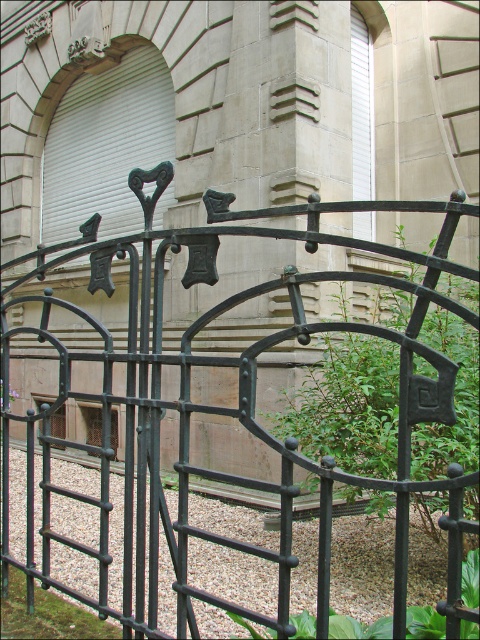
You are standing in front of a building and want to take a photo of the black wrought iron gate at center. If your camera can focus on objects as close as 1.5 meters, will you need to step back to take a clear photo of the gate?

The black wrought iron gate at center is 1.80 meters away from the viewer. Since the camera can focus as close as 1.5 meters, the distance is within the camera range. Therefore, you do not need to step back to take a clear photo of the gate.

You are a delivery person trying to determine if your 2.5 meter tall package can be delivered through the black wrought iron gate at center. Given that the smooth gravel at center is at ground level, can the package pass through the gate without tilting it?

The black wrought iron gate at center has a greater height compared to smooth gravel at center. Since the gate is taller than the gravel, which is at ground level, the height of the gate is likely sufficient to allow the 2.5 meter tall package to pass through without tilting it, provided there are no other obstructions.

You are a delivery person approaching the entrance of the building. You see the black wrought iron gate at center and the smooth gravel at center. Which object is closer to you as you approach the entrance?

The black wrought iron gate at center is closer to you since it is in front of the smooth gravel at center.